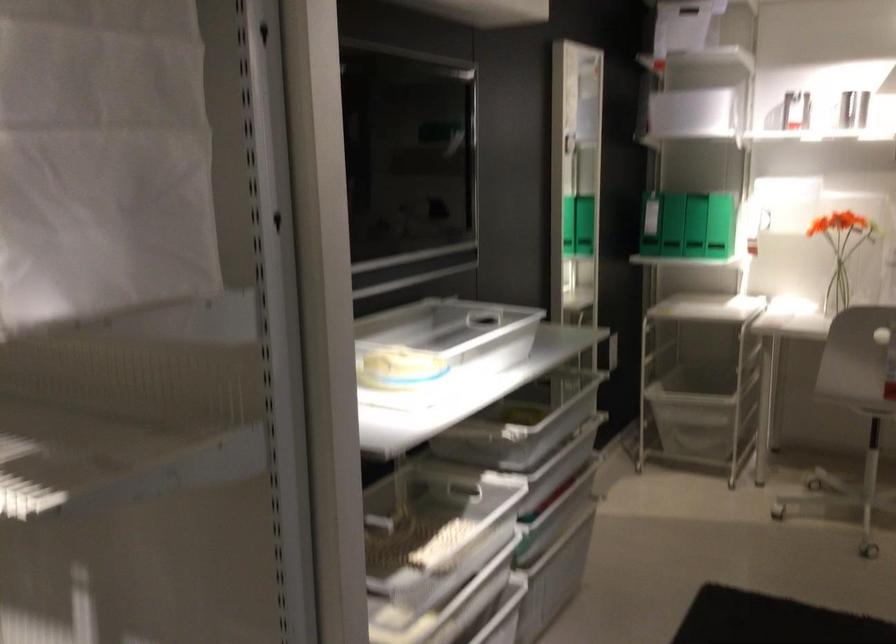
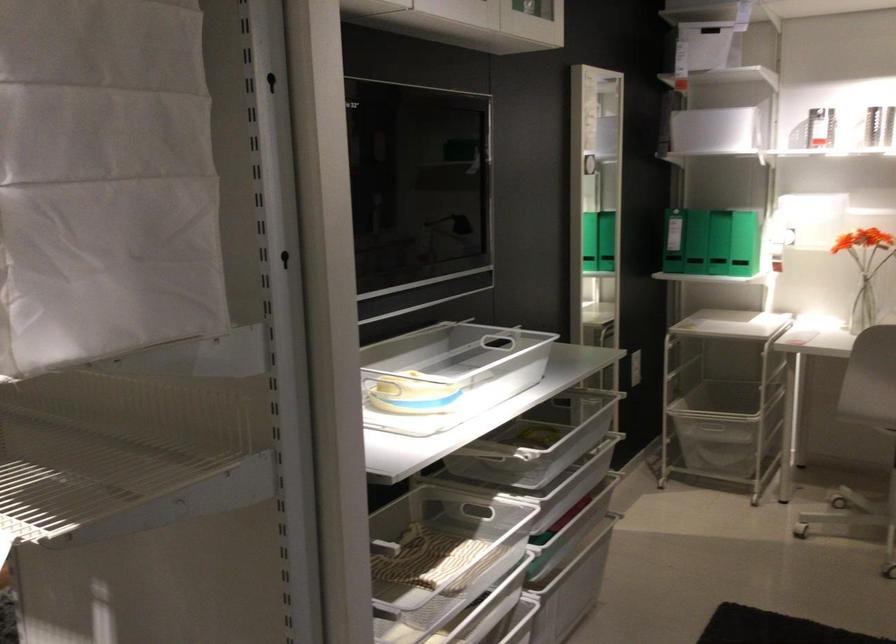
The point at (x=684, y=220) is marked in the first image. Where is the corresponding point in the second image?

(695, 242)